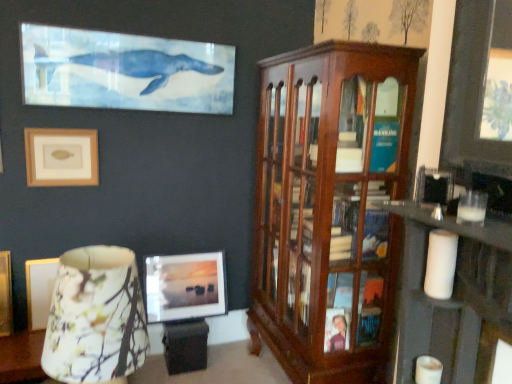
Question: Is white matte candle at lower right, arranged as the second candle when viewed from the top, taller or shorter than beige matte picture frame at upper left, the 1th picture frame when ordered from left to right?

Choices:
 (A) short
 (B) tall

Answer: (A)

Question: From a real-world perspective, is white matte candle at lower right, which is the first candle from bottom to top, physically located above or below beige matte picture frame at upper left, the first picture frame when ordered from front to back?

Choices:
 (A) below
 (B) above

Answer: (A)

Question: Which object is the closest to the white matte candle at right, the second candle from the bottom?

Choices:
 (A) floral fabric lampshade at lower left
 (B) mahogany wood cabinet at right
 (C) matte glass picture frame at center, which ranks as the second picture frame in top-to-bottom order
 (D) beige matte picture frame at upper left, placed as the 2th picture frame when sorted from back to front
 (E) white matte candle at lower right, which is the first candle from bottom to top

Answer: (E)

Question: Which of these objects is positioned closest to the mahogany wood cabinet at right?

Choices:
 (A) white matte candle at right, the second candle from the bottom
 (B) matte glass picture frame at center, which ranks as the second picture frame in top-to-bottom order
 (C) beige matte picture frame at upper left, placed as the first picture frame when sorted from top to bottom
 (D) white matte candle at lower right, arranged as the second candle when viewed from the top
 (E) floral fabric lampshade at lower left

Answer: (A)